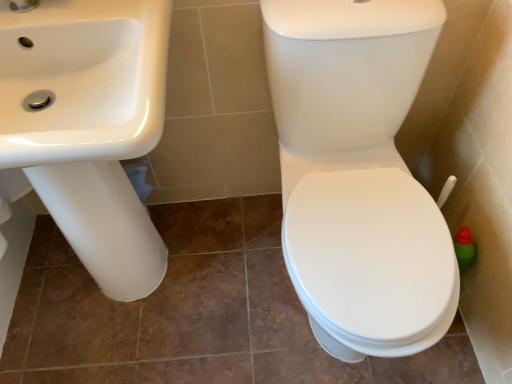
Where is `vacant space underneath white glossy sink at left (from a real-world perspective)`? vacant space underneath white glossy sink at left (from a real-world perspective) is located at coordinates (152, 290).